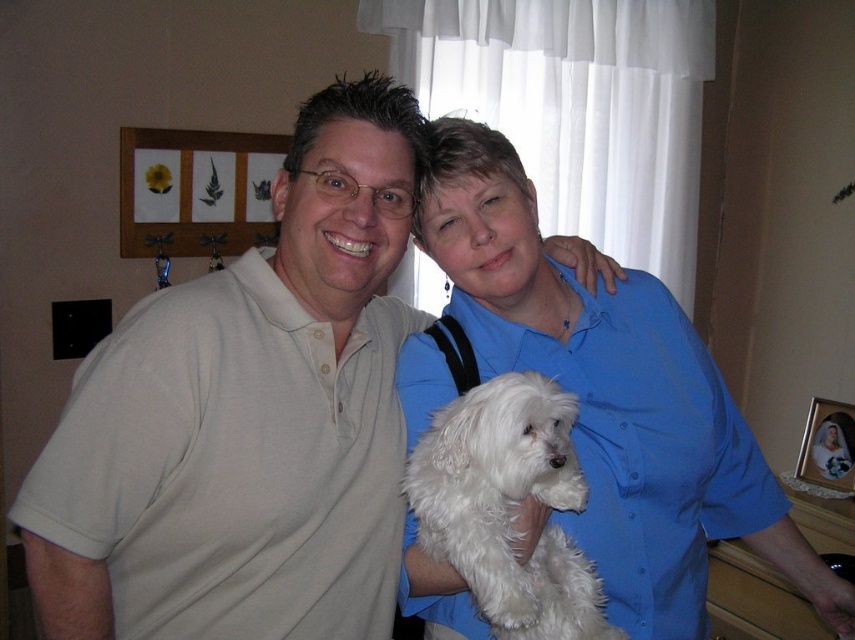
You are standing in front of the image and want to locate the matte beige polo shirt at left. What is its 2D coordinate position?

The matte beige polo shirt at left is located at the 2D coordinate point of [246,419].

You are standing at point (469, 579) and want to take a photo of the scene. The camera you have can focus on objects within 40 inches. Will the camera be able to capture the entire scene clearly?

The distance between point (469, 579) and the camera is 39.12 inches, which is within the camera focus range of 40 inches. Therefore, the camera can capture the entire scene clearly.

You are a photographer setting up for a family portrait. You want to ensure that both the white fluffy dog at center and the blue satin blouse at upper center are in focus. The camera you are using has a depth of field that can cover 6 feet. Will both subjects be in focus?

The distance between the white fluffy dog at center and the blue satin blouse at upper center is 6.13 feet. Since the camera has a depth of field of 6 feet, which is less than the required distance, both subjects may not be in focus simultaneously.